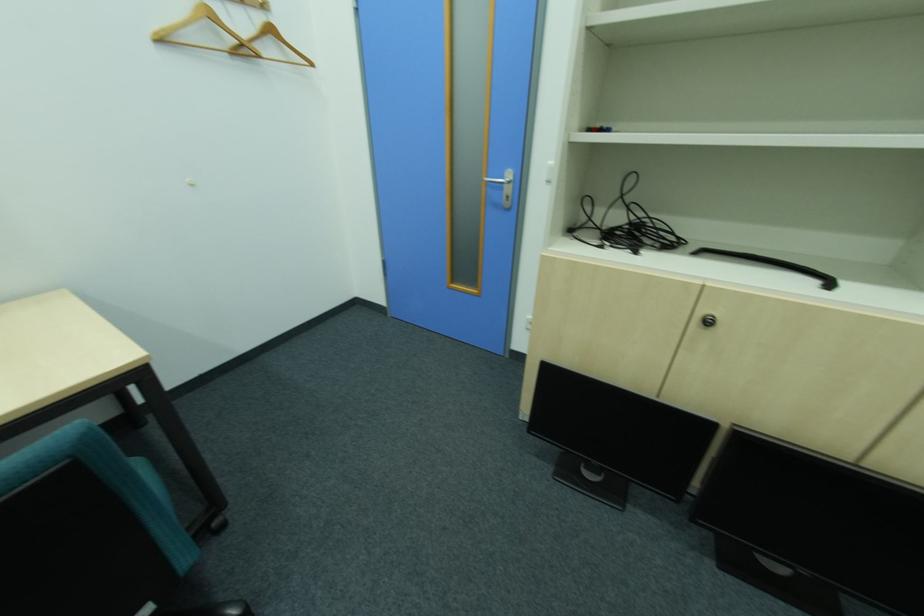
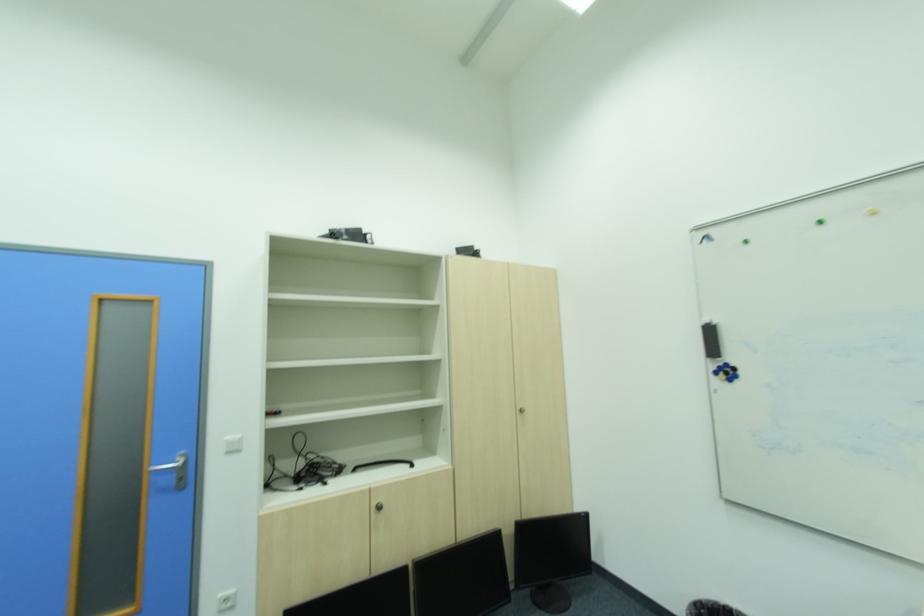
How did the camera likely rotate?

The rotation direction of the camera is right-up.